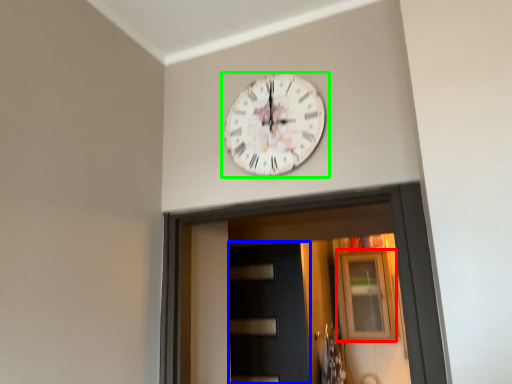
Question: Which object is the closest to the window (highlighted by a red box)? Choose among these: door (highlighted by a blue box) or wall clock (highlighted by a green box).

Choices:
 (A) door
 (B) wall clock

Answer: (A)